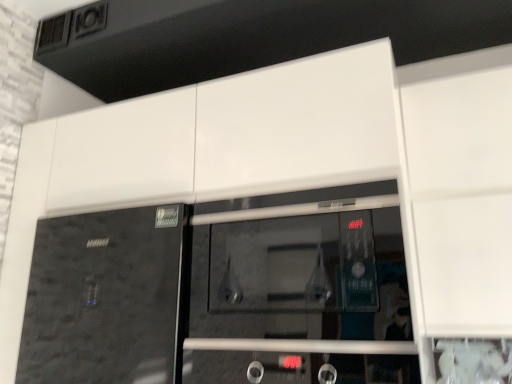
Image resolution: width=512 pixels, height=384 pixels. Describe the element at coordinates (106, 298) in the screenshot. I see `black glass door at center` at that location.

The width and height of the screenshot is (512, 384). In order to click on black glass door at center in this screenshot , I will do `click(106, 298)`.

Where is `transparent glass microwave at center`? This screenshot has height=384, width=512. transparent glass microwave at center is located at coordinates (301, 289).

What is the approximate width of transparent glass microwave at center?

11.02 inches.

What do you see at coordinates (301, 289) in the screenshot? This screenshot has width=512, height=384. I see `transparent glass microwave at center` at bounding box center [301, 289].

Where is `black glass door at center`? This screenshot has height=384, width=512. black glass door at center is located at coordinates (106, 298).

Considering the relative positions of black glass door at center and transparent glass microwave at center in the image provided, is black glass door at center to the left of transparent glass microwave at center from the viewer's perspective?

Indeed, black glass door at center is positioned on the left side of transparent glass microwave at center.

Relative to transparent glass microwave at center, is black glass door at center in front or behind?

Clearly, black glass door at center is behind transparent glass microwave at center.

Is point (170, 335) less distant than point (233, 295)?

No, (170, 335) is behind (233, 295).

From the image's perspective, does black glass door at center appear higher than transparent glass microwave at center?

No, from the image's perspective, black glass door at center is not over transparent glass microwave at center.

From a real-world perspective, is black glass door at center physically below transparent glass microwave at center?

Yes.

Is black glass door at center thinner than transparent glass microwave at center?

Incorrect, the width of black glass door at center is not less than that of transparent glass microwave at center.

Who is taller, black glass door at center or transparent glass microwave at center?

With more height is black glass door at center.

Considering the sizes of objects black glass door at center and transparent glass microwave at center in the image provided, who is smaller, black glass door at center or transparent glass microwave at center?

transparent glass microwave at center.

Would you say transparent glass microwave at center is part of black glass door at center's contents?

No, transparent glass microwave at center is not inside black glass door at center.

Does black glass door at center touch transparent glass microwave at center?

black glass door at center and transparent glass microwave at center are clearly separated.

Consider the image. Could you tell me if black glass door at center is facing transparent glass microwave at center?

No, black glass door at center is not turned towards transparent glass microwave at center.

What's the angular difference between black glass door at center and transparent glass microwave at center's facing directions?

The angle between the facing direction of black glass door at center and the facing direction of transparent glass microwave at center is 0.000134 degrees.

Identify the location of screen door that appears above the black glass door at center (from the image's perspective). (301, 289).

Which object is positioned more to the left, transparent glass microwave at center or black glass door at center?

black glass door at center is more to the left.

Based on the photo, considering the positions of objects transparent glass microwave at center and black glass door at center in the image provided, who is in front, transparent glass microwave at center or black glass door at center?

transparent glass microwave at center is closer to the camera.

Which point is more distant from viewer, (355, 303) or (177, 328)?

The point (177, 328) is farther from the camera.

From the image's perspective, which one is positioned lower, transparent glass microwave at center or black glass door at center?

black glass door at center appears lower in the image.

From a real-world perspective, which object rests below the other?

black glass door at center is physically lower.

Which of these two, transparent glass microwave at center or black glass door at center, is wider?

Wider between the two is black glass door at center.

Considering the sizes of transparent glass microwave at center and black glass door at center in the image, is transparent glass microwave at center taller or shorter than black glass door at center?

Clearly, transparent glass microwave at center is shorter compared to black glass door at center.

Between transparent glass microwave at center and black glass door at center, which one has larger size?

With larger size is black glass door at center.

Consider the image. Can black glass door at center be found inside transparent glass microwave at center?

No, transparent glass microwave at center does not contain black glass door at center.

Is transparent glass microwave at center not near black glass door at center?

Result: No, transparent glass microwave at center is in close proximity to black glass door at center.

Could you tell me if transparent glass microwave at center is facing black glass door at center?

No.

Where is `screen door that appears in front of the black glass door at center`? The image size is (512, 384). screen door that appears in front of the black glass door at center is located at coordinates (301, 289).

This screenshot has height=384, width=512. I want to click on screen door that is on the right side of black glass door at center, so click(x=301, y=289).

The image size is (512, 384). What are the coordinates of `screen door above the black glass door at center (from a real-world perspective)` in the screenshot? It's located at (301, 289).